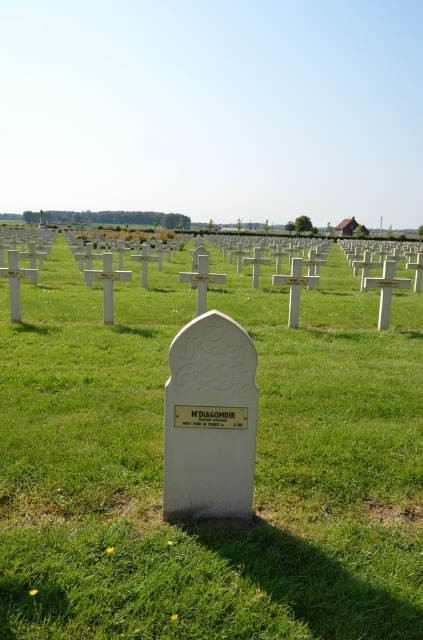
Question: Can you confirm if white stone cross at center is wider than white stone gravestone at center?

Choices:
 (A) no
 (B) yes

Answer: (B)

Question: Is white stone cross at center further to the viewer compared to white stone gravestone at center?

Choices:
 (A) no
 (B) yes

Answer: (A)

Question: Is white stone cross at center below white stone gravestone at center?

Choices:
 (A) yes
 (B) no

Answer: (B)

Question: Which point is farther to the camera?

Choices:
 (A) (176, 429)
 (B) (38, 368)

Answer: (B)